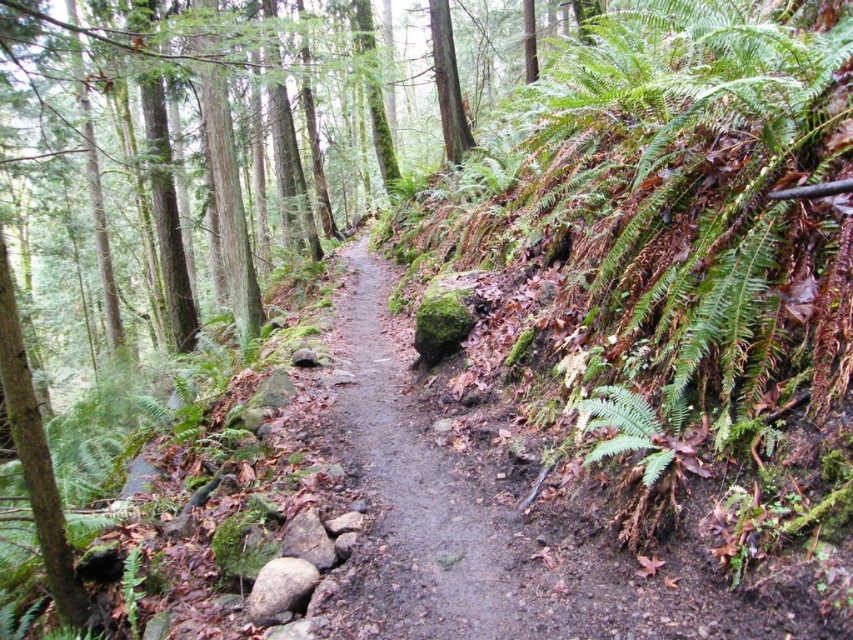
Can you confirm if dirt path at center is positioned above green leafy fern at lower right?

No.

Can you confirm if dirt path at center is positioned to the right of green leafy fern at lower right?

In fact, dirt path at center is to the left of green leafy fern at lower right.

The width and height of the screenshot is (853, 640). Find the location of `dirt path at center`. dirt path at center is located at coordinates (412, 497).

Find the location of a particular element. The height and width of the screenshot is (640, 853). dirt path at center is located at coordinates (412, 497).